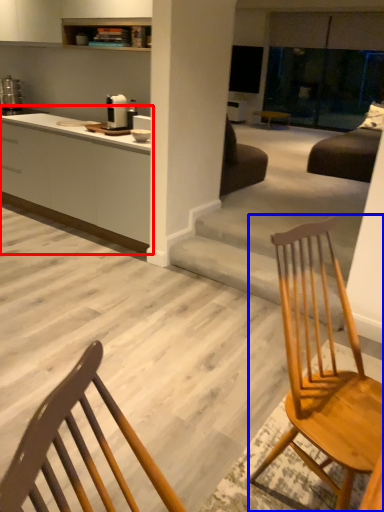
Question: Which point is further to the camera, cabinetry (highlighted by a red box) or chair (highlighted by a blue box)?

Choices:
 (A) cabinetry
 (B) chair

Answer: (A)